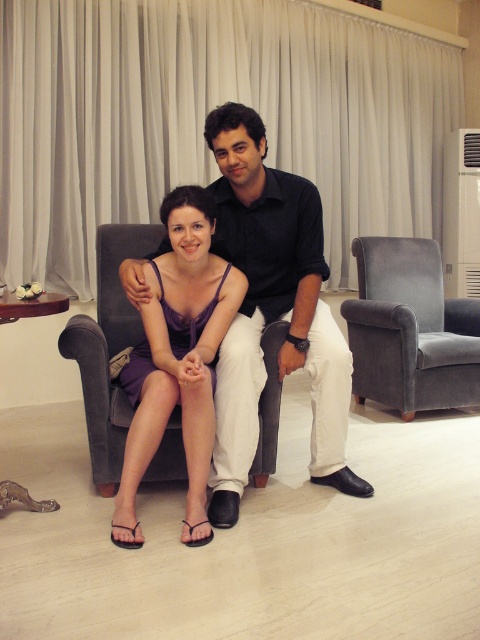
You are standing in the living room and want to touch the purple satin dress at center. The coordinates of the dress are given as point (x=178, y=358). If you move straight towards it, will you reach the dress before encountering any obstacles?

The purple satin dress at center is represented by point (x=178, y=358), so moving straight towards it would lead you directly to the dress without encountering any obstacles in between.

You are a photographer setting up a shoot in this living room. You want to place a small lamp between the black smooth shirt at center and the velvet gray armchair at right. According to the scene description, where should you position the lamp?

The lamp should be placed between the black smooth shirt at center and the velvet gray armchair at right, as the black smooth shirt at center is positioned on the left side of velvet gray armchair at right.

You are a delivery person who needs to place a small package between the black smooth shirt at center and the velvet gray armchair at right. Can you fit the package there if it measures 1.2 meters in length?

The distance between the black smooth shirt at center and the velvet gray armchair at right is 1.32 meters, so the 1.2 meter package can fit between them since it is shorter than the available space.